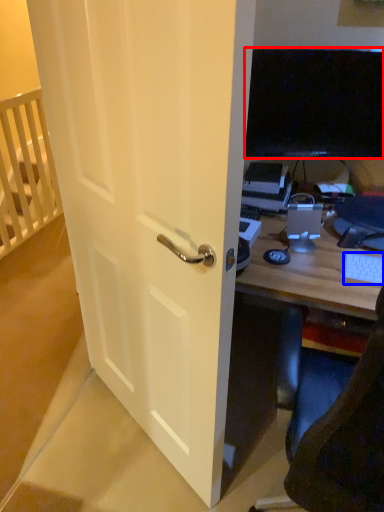
Question: Which of the following is the closest to the observer, television (highlighted by a red box) or computer keyboard (highlighted by a blue box)?

Choices:
 (A) television
 (B) computer keyboard

Answer: (B)